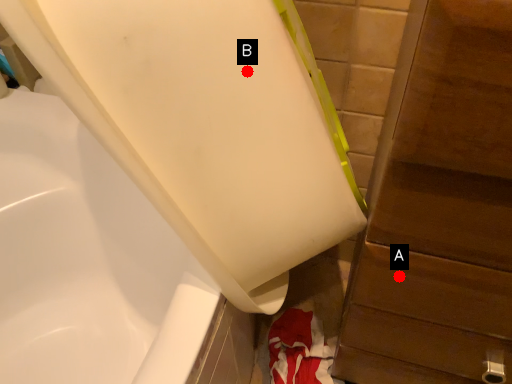
Question: Two points are circled on the image, labeled by A and B beside each circle. Which point is closer to the camera?

Choices:
 (A) A is closer
 (B) B is closer

Answer: (B)